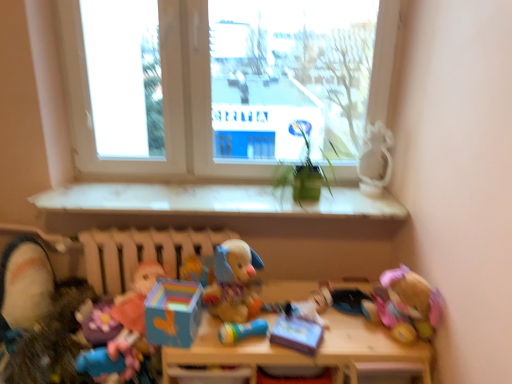
Locate an element on the screen. blank area to the left of fluffy pink teddy bear at right, which is the ninth toy from left to right is located at coordinates (350, 333).